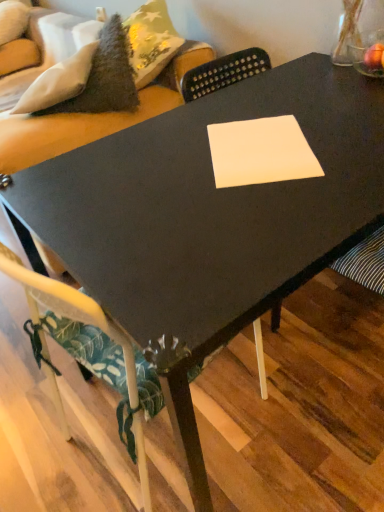
Describe the element at coordinates (69, 309) in the screenshot. I see `white fabric chair at lower left` at that location.

The height and width of the screenshot is (512, 384). What do you see at coordinates (85, 78) in the screenshot?
I see `velvet green couch at upper left` at bounding box center [85, 78].

Where is `white paper at center`? white paper at center is located at coordinates pyautogui.click(x=260, y=152).

How different are the orientations of velvet green couch at upper left and white fabric chair at lower left in degrees?

velvet green couch at upper left and white fabric chair at lower left are facing 147 degrees away from each other.

Is point (143, 68) farther from viewer compared to point (14, 257)?

Yes.

Considering the sizes of objects velvet green couch at upper left and white fabric chair at lower left in the image provided, who is shorter, velvet green couch at upper left or white fabric chair at lower left?

white fabric chair at lower left.

Is velvet green couch at upper left positioned far away from white fabric chair at lower left?

No, there isn't a large distance between velvet green couch at upper left and white fabric chair at lower left.

Is white paper at center looking in the opposite direction of white fabric chair at lower left?

white paper at center is not turned away from white fabric chair at lower left.

Would you say white fabric chair at lower left is part of white paper at center's contents?

No, white fabric chair at lower left is not surrounded by white paper at center.

At what (x,y) coordinates should I click in order to perform the action: click on chair located below the white paper at center (from the image's perspective). Please return your answer as a coordinate pair (x, y). Looking at the image, I should click on (69, 309).

Considering the positions of objects white paper at center and white fabric chair at lower left in the image provided, who is more to the left, white paper at center or white fabric chair at lower left?

white fabric chair at lower left is more to the left.

Is velvet green couch at upper left far away from white paper at center?

velvet green couch at upper left is actually quite close to white paper at center.

From the image's perspective, is velvet green couch at upper left above or below white paper at center?

velvet green couch at upper left is above white paper at center.

Relative to white paper at center, is velvet green couch at upper left in front or behind?

In the image, velvet green couch at upper left appears behind white paper at center.

Is velvet green couch at upper left at the right side of white paper at center?

In fact, velvet green couch at upper left is to the left of white paper at center.

Is white fabric chair at lower left to the left of velvet green couch at upper left from the viewer's perspective?

In fact, white fabric chair at lower left is to the right of velvet green couch at upper left.

Is white fabric chair at lower left wider than velvet green couch at upper left?

No.

Does point (88, 317) lie in front of point (59, 114)?

Yes, point (88, 317) is in front of point (59, 114).

From the image's perspective, is white fabric chair at lower left on velvet green couch at upper left?

Incorrect, from the image's perspective, white fabric chair at lower left is lower than velvet green couch at upper left.

Considering the sizes of objects white fabric chair at lower left and white paper at center in the image provided, who is smaller, white fabric chair at lower left or white paper at center?

white paper at center is smaller.

Considering the relative sizes of white fabric chair at lower left and white paper at center in the image provided, is white fabric chair at lower left taller than white paper at center?

Correct, white fabric chair at lower left is much taller as white paper at center.

From a real-world perspective, relative to white paper at center, is white fabric chair at lower left vertically above or below?

In terms of real-world spatial position, white fabric chair at lower left is below white paper at center.

Is white fabric chair at lower left far away from white paper at center?

No, white fabric chair at lower left is not far away from white paper at center.

Which object is thinner, white paper at center or velvet green couch at upper left?

Thinner between the two is white paper at center.

You are a GUI agent. You are given a task and a screenshot of the screen. Output one action in this format:
    pyautogui.click(x=<x>, y=<y>)
    Task: Click on the couch located above the white paper at center (from the image's perspective)
    Image resolution: width=384 pixels, height=512 pixels.
    Given the screenshot: What is the action you would take?
    pyautogui.click(x=85, y=78)

Considering the relative sizes of white paper at center and velvet green couch at upper left in the image provided, is white paper at center smaller than velvet green couch at upper left?

Yes, white paper at center is smaller than velvet green couch at upper left.

This screenshot has height=512, width=384. In order to click on chair below the velvet green couch at upper left (from a real-world perspective) in this screenshot , I will do `click(69, 309)`.

At what (x,y) coordinates should I click in order to perform the action: click on rectangle above the white fabric chair at lower left (from a real-world perspective). Please return your answer as a coordinate pair (x, y). The image size is (384, 512). Looking at the image, I should click on (260, 152).

Consider the image. From the image, which object appears to be farther from velvet green couch at upper left, white fabric chair at lower left or white paper at center?

white fabric chair at lower left lies further to velvet green couch at upper left than the other object.

Looking at the image, which one is located closer to velvet green couch at upper left, white paper at center or white fabric chair at lower left?

The object closer to velvet green couch at upper left is white paper at center.

Based on their spatial positions, is white fabric chair at lower left or velvet green couch at upper left closer to white paper at center?

Based on the image, white fabric chair at lower left appears to be nearer to white paper at center.

Considering their positions, is velvet green couch at upper left positioned further to white paper at center than white fabric chair at lower left?

Among the two, velvet green couch at upper left is located further to white paper at center.

Looking at the image, which one is located closer to white fabric chair at lower left, velvet green couch at upper left or white paper at center?

white paper at center lies closer to white fabric chair at lower left than the other object.

Considering their positions, is white paper at center positioned further to white fabric chair at lower left than velvet green couch at upper left?

Among the two, velvet green couch at upper left is located further to white fabric chair at lower left.

Where is `rectangle between velvet green couch at upper left and white fabric chair at lower left in the vertical direction`? The image size is (384, 512). rectangle between velvet green couch at upper left and white fabric chair at lower left in the vertical direction is located at coordinates (260, 152).